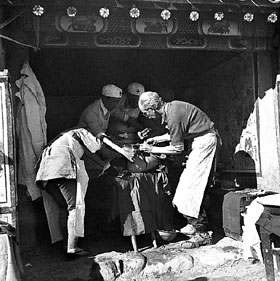
I want to click on aprons, so click(x=79, y=175), click(x=105, y=123), click(x=119, y=125), click(x=196, y=166).